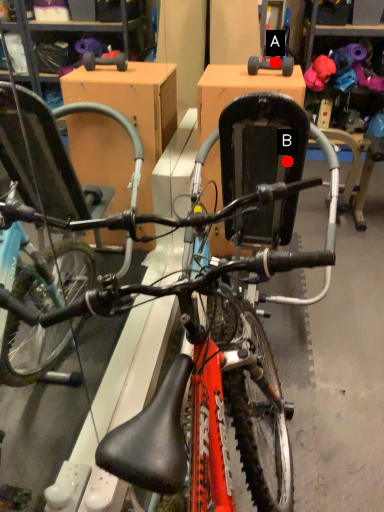
Question: Two points are circled on the image, labeled by A and B beside each circle. Which point is closer to the camera taking this photo?

Choices:
 (A) A is closer
 (B) B is closer

Answer: (B)